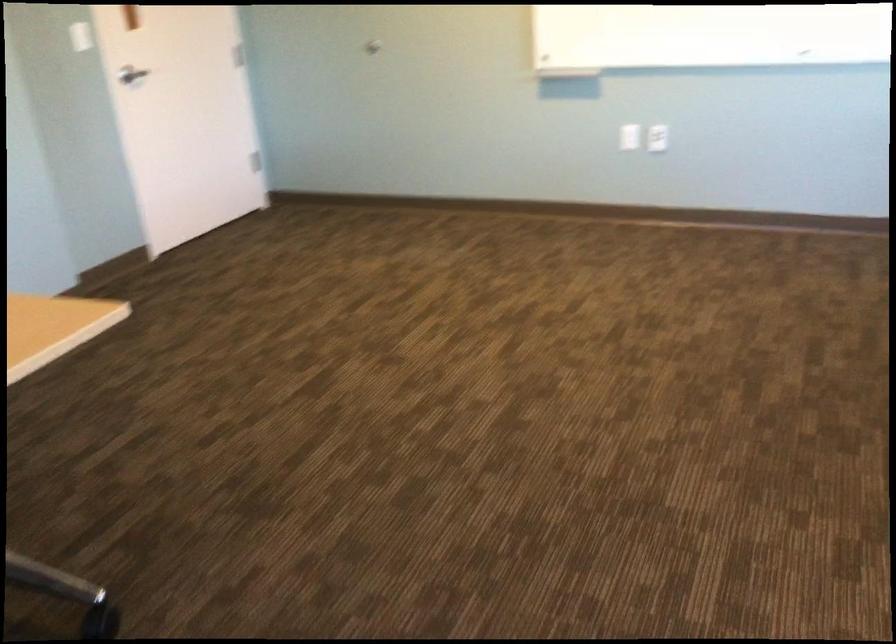
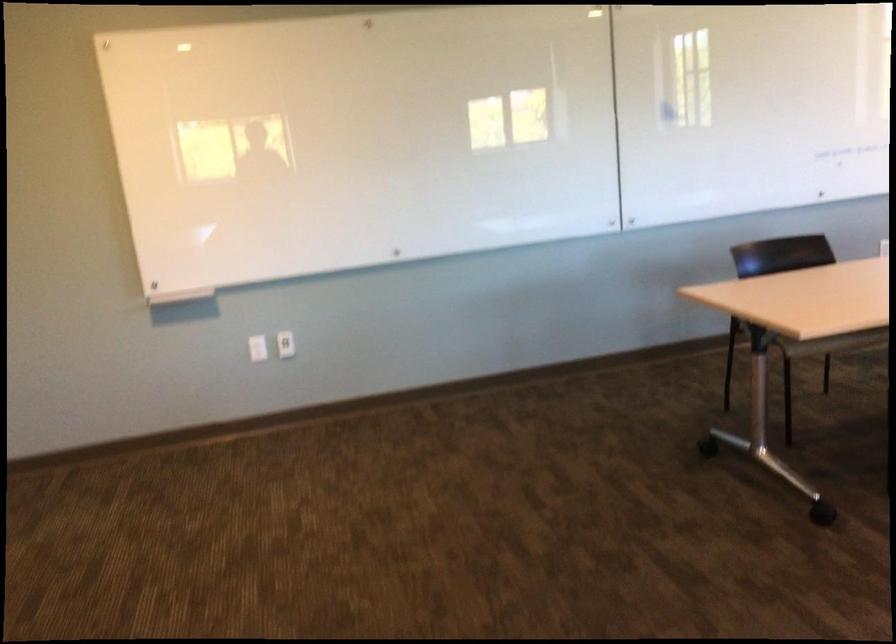
Find the pixel in the second image that matches (x=629, y=133) in the first image.

(256, 348)